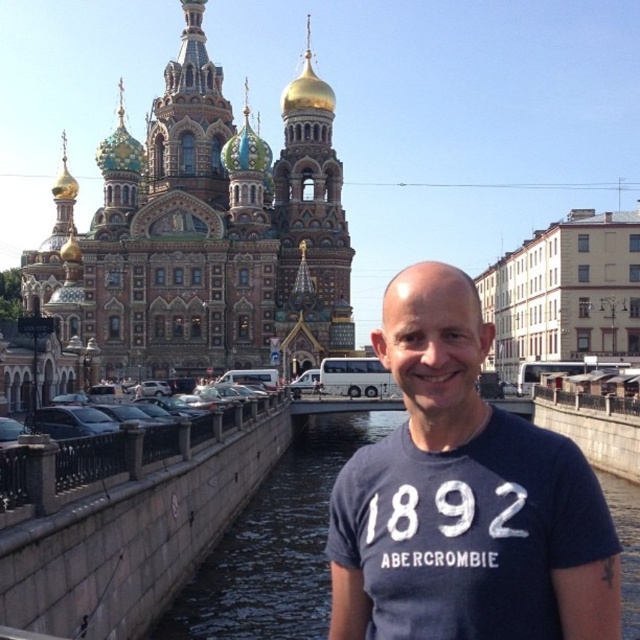
You are standing in front of the cathedral and want to take a photo that includes both the man and the golden dome. The man is at point (449, 404) and the dome is at point (216, 595). Which point should you focus on first to ensure both are in focus?

You should focus on point (449, 404) first because it is closer to the viewer than point (216, 595). This ensures the man is in focus, and since the dome is further away, adjusting the focus from the closer point outward can help capture both elements clearly.